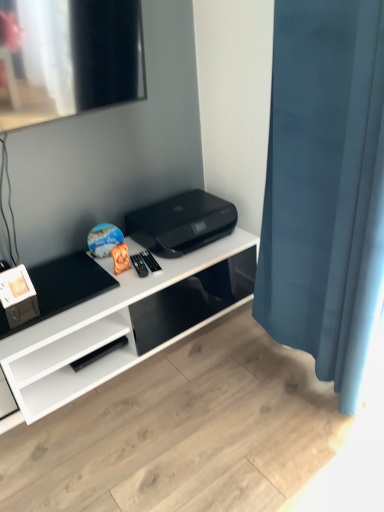
Find the location of a particular element. Image resolution: width=384 pixels, height=512 pixels. white glossy desk at center is located at coordinates (114, 329).

Where is `white glossy desk at center`? white glossy desk at center is located at coordinates (114, 329).

Which is behind, blue velvet curtain at right or white glossy desk at center?

white glossy desk at center is behind.

You are a GUI agent. You are given a task and a screenshot of the screen. Output one action in this format:
    pyautogui.click(x=<x>, y=<y>)
    Task: Click on the shower curtain in front of the white glossy desk at center
    This screenshot has width=384, height=512.
    Given the screenshot: What is the action you would take?
    coord(325,188)

Based on their positions, is blue velvet curtain at right located to the left or right of white glossy desk at center?

From the image, it's evident that blue velvet curtain at right is to the right of white glossy desk at center.

From the image's perspective, between black plastic printer at center and blue velvet curtain at right, who is located below?

From the image's view, blue velvet curtain at right is below.

Is black plastic printer at center directly adjacent to blue velvet curtain at right?

black plastic printer at center and blue velvet curtain at right are clearly separated.

In the scene shown: Is black plastic printer at center oriented away from blue velvet curtain at right?

black plastic printer at center is not turned away from blue velvet curtain at right.

Would you say black plastic printer at center contains blue velvet curtain at right?

Definitely not — blue velvet curtain at right is not inside black plastic printer at center.

Is black plastic printer at center smaller than white glossy desk at center?

Indeed, black plastic printer at center has a smaller size compared to white glossy desk at center.

How many degrees apart are the facing directions of black plastic printer at center and white glossy desk at center?

They differ by 0.602 degrees in their facing directions.

Is black plastic printer at center to the left or to the right of white glossy desk at center in the image?

From the image, it's evident that black plastic printer at center is to the right of white glossy desk at center.

From a real-world perspective, is black plastic printer at center located higher than white glossy desk at center?

Yes, from a real-world perspective, black plastic printer at center is above white glossy desk at center.

From the image's perspective, would you say blue velvet curtain at right is positioned over black plastic printer at center?

No, from the image's perspective, blue velvet curtain at right is not on top of black plastic printer at center.

Based on the photo, is the position of blue velvet curtain at right more distant than that of black plastic printer at center?

No, it is not.

Is blue velvet curtain at right oriented towards black plastic printer at center?

No, blue velvet curtain at right does not turn towards black plastic printer at center.

Is black plastic printer at center inside white glossy desk at center?

Definitely not — black plastic printer at center is not inside white glossy desk at center.

Is white glossy desk at center taller or shorter than black plastic printer at center?

Clearly, white glossy desk at center is taller compared to black plastic printer at center.

Between point (95, 346) and point (166, 254), which one is positioned in front?

Positioned in front is point (95, 346).

In the image, is white glossy desk at center positioned in front of or behind black plastic printer at center?

Clearly, white glossy desk at center is in front of black plastic printer at center.

From a real-world perspective, is white glossy desk at center located beneath blue velvet curtain at right?

Yes, from a real-world perspective, white glossy desk at center is under blue velvet curtain at right.

Does white glossy desk at center have a smaller size compared to blue velvet curtain at right?

No.

Considering the relative sizes of white glossy desk at center and blue velvet curtain at right in the image provided, is white glossy desk at center taller than blue velvet curtain at right?

No, white glossy desk at center is not taller than blue velvet curtain at right.

From the image's perspective, is white glossy desk at center located above or below blue velvet curtain at right?

Based on their image positions, white glossy desk at center is located beneath blue velvet curtain at right.

Image resolution: width=384 pixels, height=512 pixels. Find the location of `shower curtain lying above the white glossy desk at center (from the image's perspective)`. shower curtain lying above the white glossy desk at center (from the image's perspective) is located at coordinates (325, 188).

Where is `shower curtain above the black plastic printer at center (from a real-world perspective)`? shower curtain above the black plastic printer at center (from a real-world perspective) is located at coordinates (325, 188).

Looking at the image, which one is located further to white glossy desk at center, black plastic printer at center or blue velvet curtain at right?

blue velvet curtain at right is positioned further to the anchor white glossy desk at center.

Which object lies nearer to the anchor point blue velvet curtain at right, white glossy desk at center or black plastic printer at center?

Among the two, black plastic printer at center is located nearer to blue velvet curtain at right.

Based on their spatial positions, is white glossy desk at center or blue velvet curtain at right further from black plastic printer at center?

The object further to black plastic printer at center is blue velvet curtain at right.

Estimate the real-world distances between objects in this image. Which object is further from blue velvet curtain at right, black plastic printer at center or white glossy desk at center?

Based on the image, white glossy desk at center appears to be further to blue velvet curtain at right.

From the image, which object appears to be nearer to black plastic printer at center, blue velvet curtain at right or white glossy desk at center?

white glossy desk at center is closer to black plastic printer at center.

Looking at this image, which object lies nearer to the anchor point white glossy desk at center, blue velvet curtain at right or black plastic printer at center?

black plastic printer at center is positioned closer to the anchor white glossy desk at center.

I want to click on desk positioned between blue velvet curtain at right and black plastic printer at center from near to far, so 114,329.